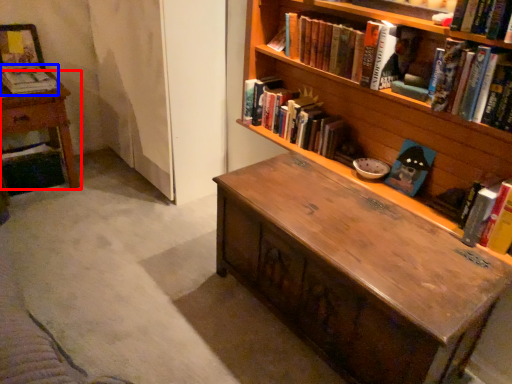
Question: Which object appears farthest to the camera in this image, table (highlighted by a red box) or book (highlighted by a blue box)?

Choices:
 (A) table
 (B) book

Answer: (B)